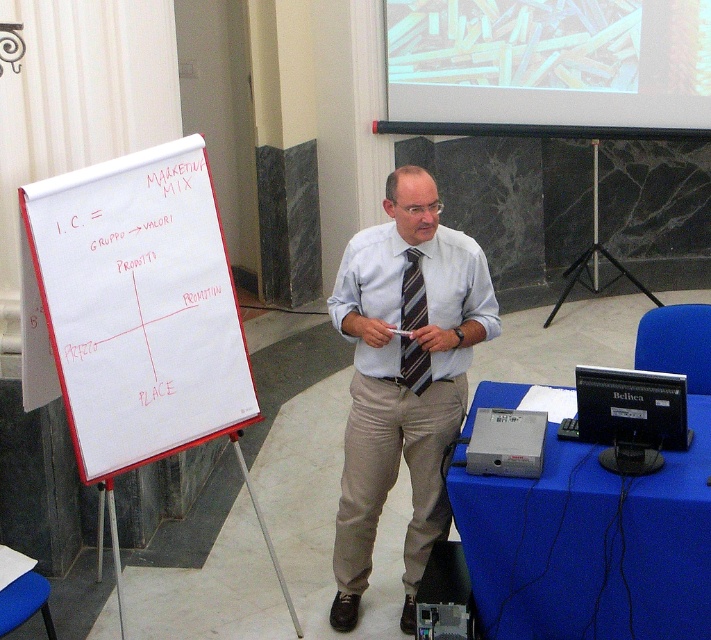
From the picture: You are an attendee at the presentation. You notice the translucent plastic screen at upper center and the striped fabric tie at center. Which object is positioned higher in the image?

The translucent plastic screen at upper center is positioned higher than the striped fabric tie at center.

You are standing in the presentation room and see two points marked on the flipchart. The first point is at coordinates point (646, 45) and the second is at point (447, 300). Which point is closer to you?

Point (447, 300) is closer to you because point (646, 45) is behind it.